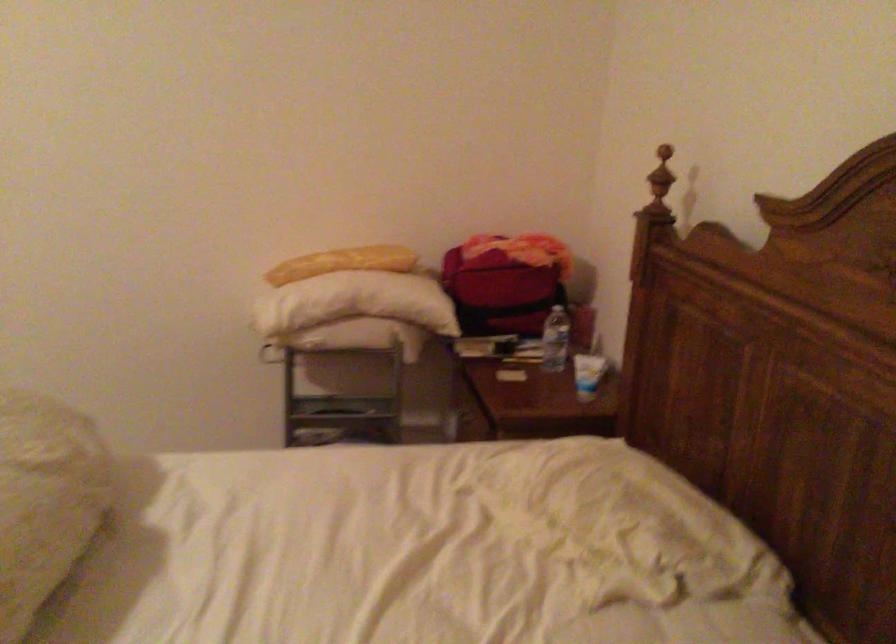
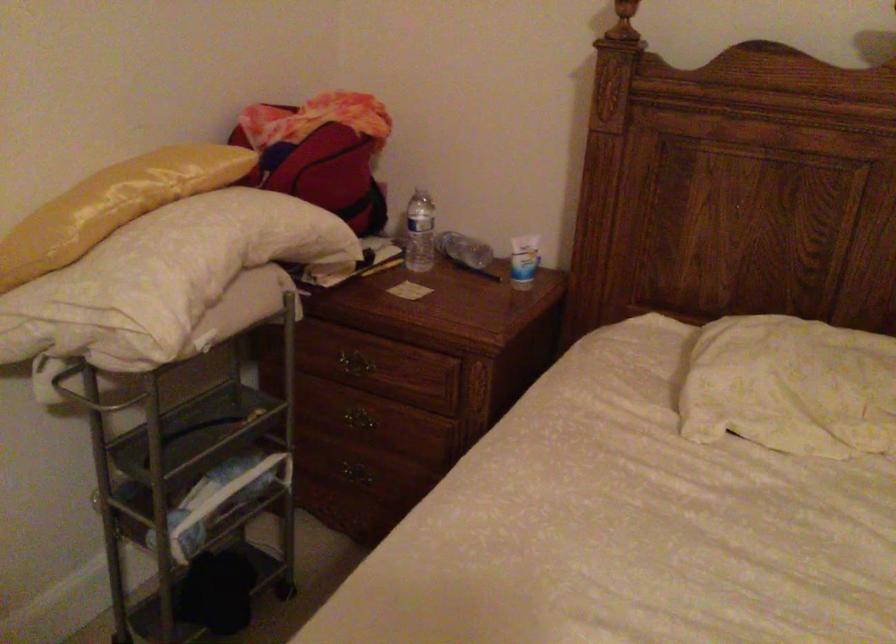
Locate, in the second image, the point that corresponds to [467,413] in the first image.

(350, 365)